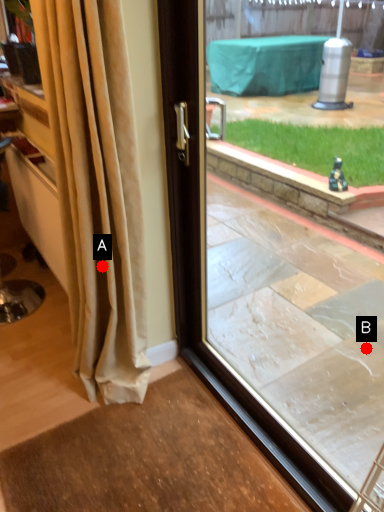
Question: Two points are circled on the image, labeled by A and B beside each circle. Which point is closer to the camera taking this photo?

Choices:
 (A) A is closer
 (B) B is closer

Answer: (A)